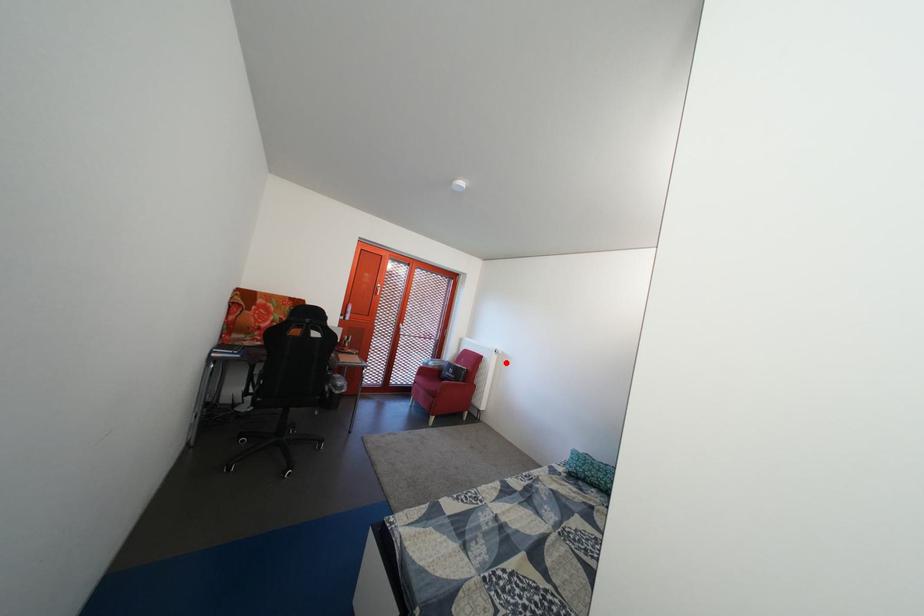
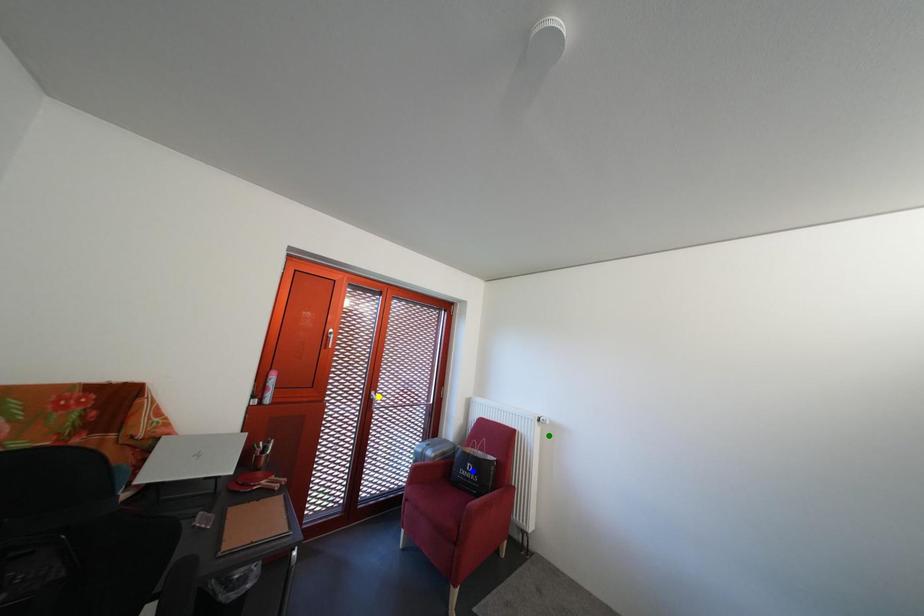
Question: I am providing you with two images of the same scene from different viewpoints. A red point is marked on the first image. You are given multiple points on the second image. Which spot in image 2 lines up with the point in image 1?

Choices:
 (A) yellow point
 (B) blue point
 (C) green point

Answer: (C)